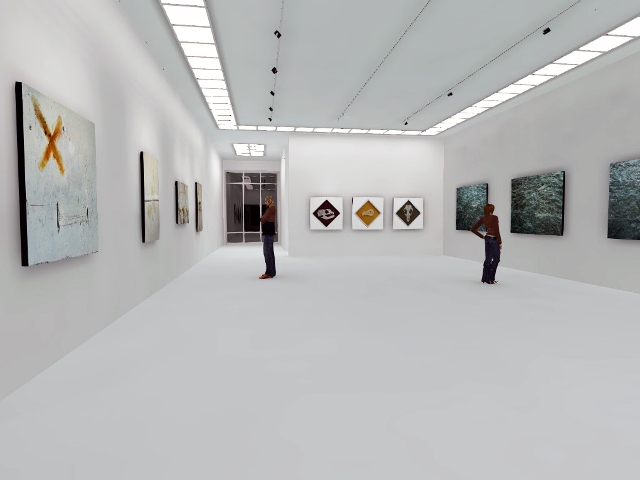
Locate an element on the screen. white ceiling is located at coordinates (355, 89).